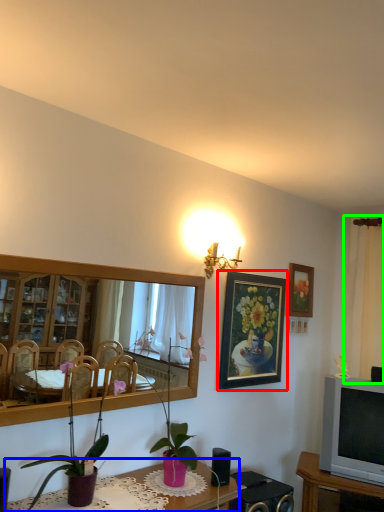
Question: Estimate the real-world distances between objects in this image. Which object is closer to picture frame (highlighted by a red box), table (highlighted by a blue box) or curtain (highlighted by a green box)?

Choices:
 (A) table
 (B) curtain

Answer: (A)